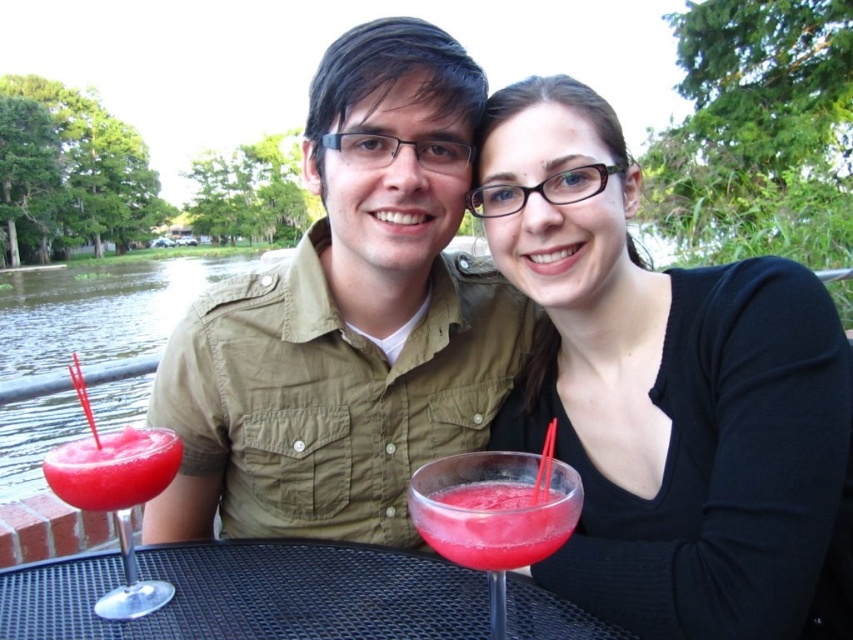
You are a photographer trying to capture a closeup shot of the matte black shirt at center and the black mesh table at center. Which object should you focus on first if you want to ensure both are in focus without moving the camera?

The matte black shirt at center has a larger size compared to black mesh table at center, so you should focus on the matte black shirt at center first to ensure both are in focus.

You are standing at the point with coordinates point [187,378] and want to walk to the point with coordinates point [503,509]. According to the scene, which direction should you move to reach your destination?

You should move forward because point [187,378] is behind point [503,509], so moving forward from point [187,378] will lead you toward point [503,509].

You are a photographer taking a picture of the matte khaki shirt at center and the translucent pink drink at center. Which object should you focus on if you want to capture the larger one in your shot?

The matte khaki shirt at center has a larger size compared to the translucent pink drink at center, so you should focus on the matte khaki shirt at center to capture the larger one.